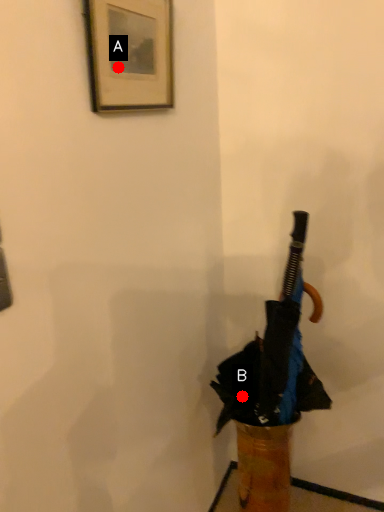
Question: Two points are circled on the image, labeled by A and B beside each circle. Among these points, which one is nearest to the camera?

Choices:
 (A) A is closer
 (B) B is closer

Answer: (A)